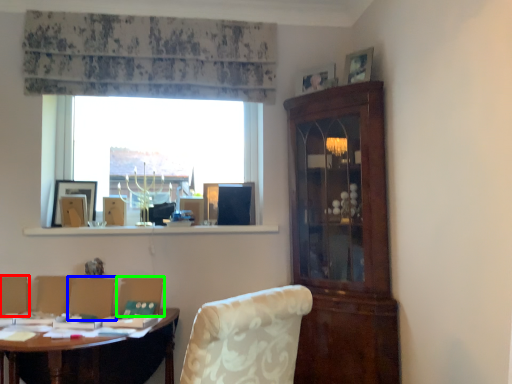
Question: Considering the real-world distances, which object is farthest from armchair (highlighted by a red box)? armchair (highlighted by a blue box) or armchair (highlighted by a green box)?

Choices:
 (A) armchair
 (B) armchair

Answer: (B)